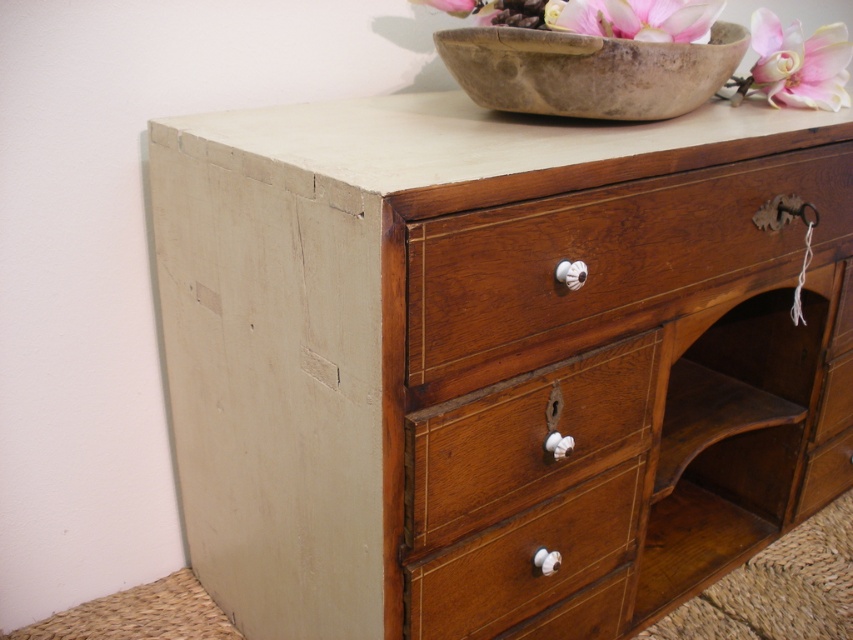
Question: Which object is the closest to the polished wood drawer at center?

Choices:
 (A) pink petal at upper center
 (B) wooden dresser at upper center
 (C) pink silk flower at upper right

Answer: (B)

Question: Does wooden dresser at upper center appear on the right side of wooden drawer at center?

Choices:
 (A) no
 (B) yes

Answer: (B)

Question: Is wooden drawer at center smaller than pink silk flower at upper right?

Choices:
 (A) no
 (B) yes

Answer: (A)

Question: Which point appears closest to the camera in this image?

Choices:
 (A) (610, 10)
 (B) (431, 1)

Answer: (A)

Question: Does pink petal at upper center appear under pink silk flower at upper center?

Choices:
 (A) yes
 (B) no

Answer: (A)

Question: Which object is farther from the camera taking this photo?

Choices:
 (A) pink silk flower at upper center
 (B) mahogany wood drawer at center
 (C) pink petal at upper center

Answer: (A)